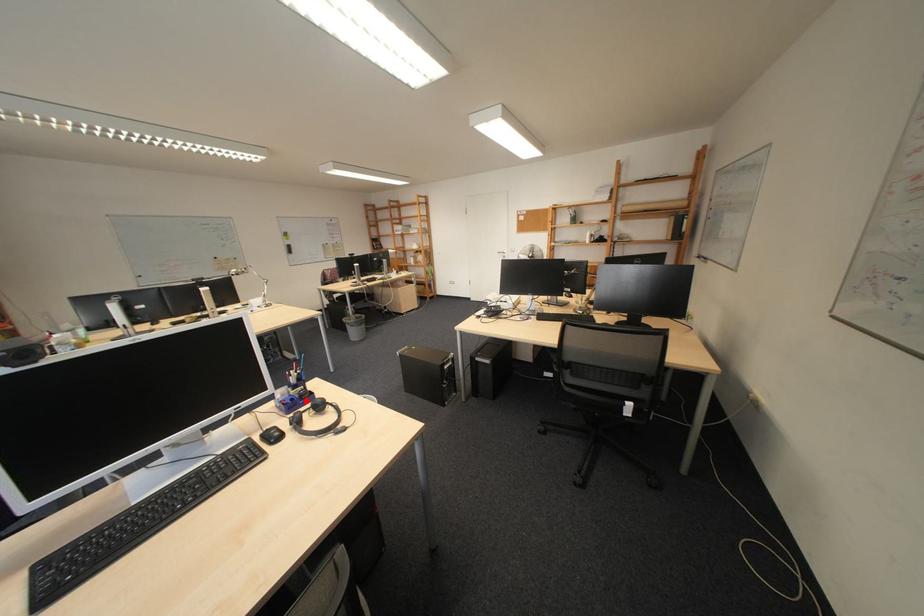
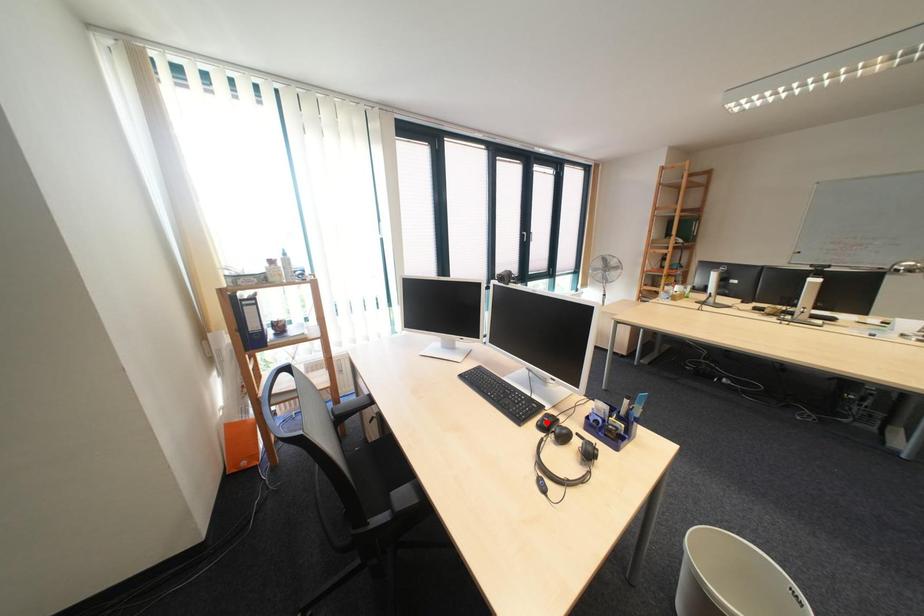
I am providing you with two images of the same scene from different viewpoints. A red point is marked on the first image and another point is marked on the second image. Is the marked point in image1 the same physical position as the marked point in image2?

No